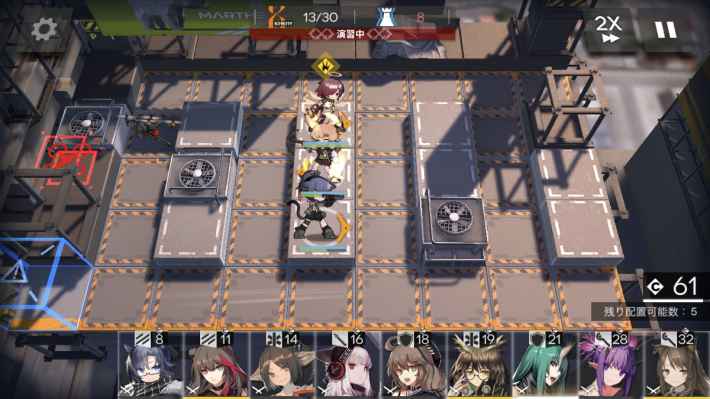
I want to click on fan, so coord(94,116), coord(202,178), coord(453,220).